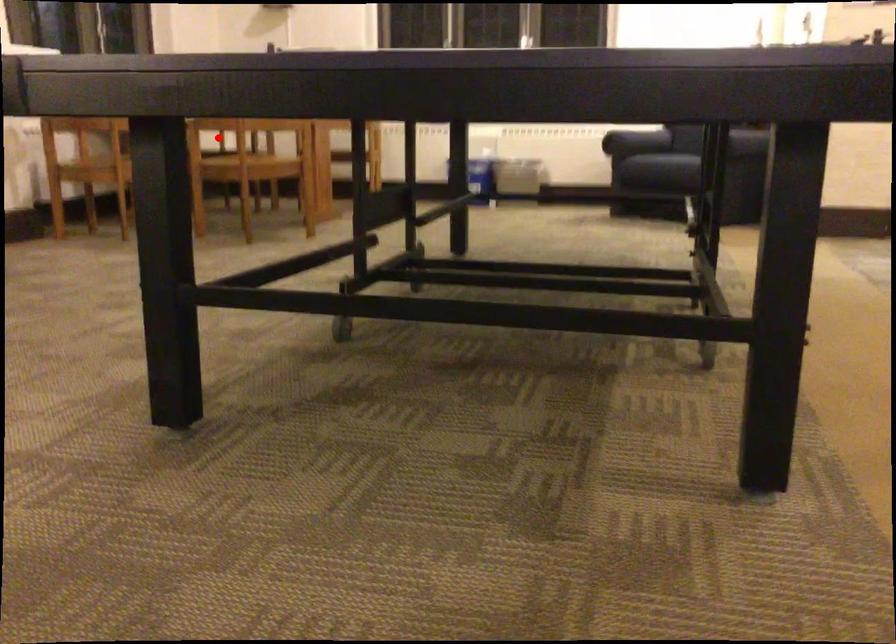
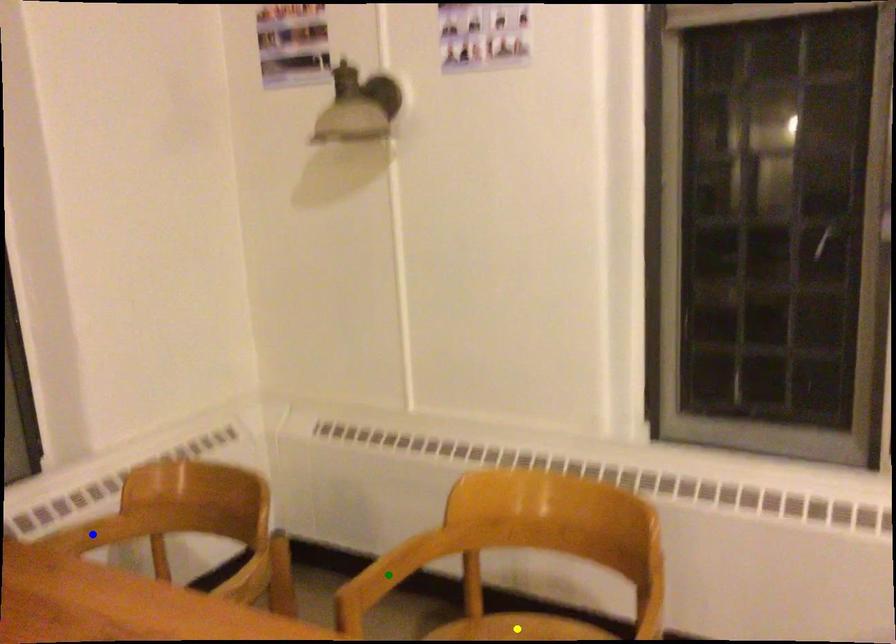
Question: I am providing you with two images of the same scene from different viewpoints. A red point is marked on the first image. You are given multiple points on the second image. Which spot in image 2 lines up with the point in image 1?

Choices:
 (A) green point
 (B) blue point
 (C) yellow point

Answer: (B)